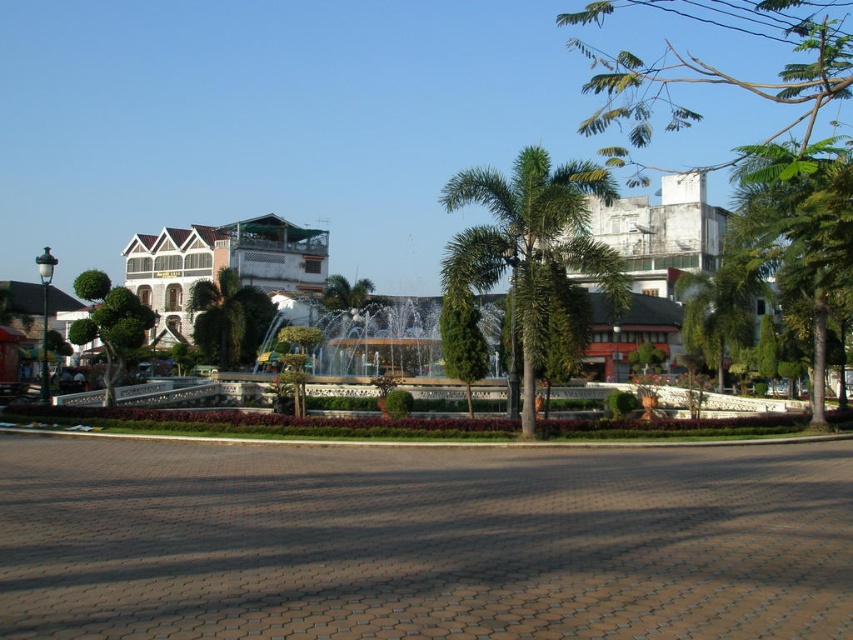
Question: Can you confirm if green leafy tree at upper right is positioned below green glossy tree at left?

Choices:
 (A) no
 (B) yes

Answer: (A)

Question: Does brown cobblestone plaza at center lie behind green leafy palm tree at center?

Choices:
 (A) no
 (B) yes

Answer: (A)

Question: Can you confirm if brown cobblestone plaza at center is smaller than green leafy tree at upper right?

Choices:
 (A) yes
 (B) no

Answer: (A)

Question: Which object is positioned farthest from the green concrete fountain at center?

Choices:
 (A) green leafy tree at upper right
 (B) green glossy tree at left

Answer: (A)

Question: Which object is closer to the camera taking this photo?

Choices:
 (A) brown cobblestone plaza at center
 (B) white textured building at center
 (C) green glossy tree at left

Answer: (A)

Question: Which of the following is the closest to the observer?

Choices:
 (A) green leafy tree at center
 (B) green glossy tree at left
 (C) green leafy palm tree at center
 (D) green concrete fountain at center

Answer: (D)